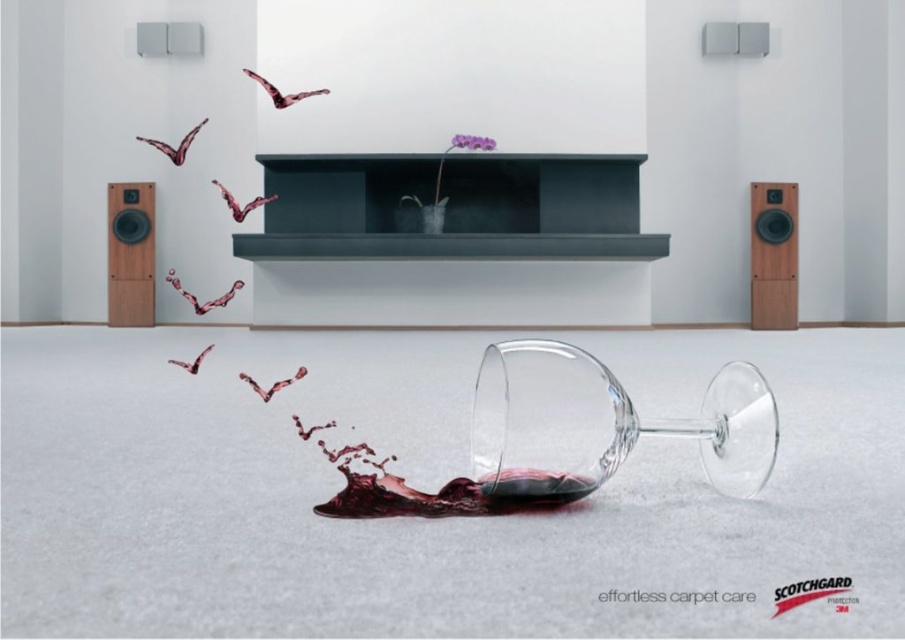
Is transparent glass at center above cherry wood speaker at right?

Actually, transparent glass at center is below cherry wood speaker at right.

Where is `transparent glass at center`? transparent glass at center is located at coordinates (603, 422).

Locate an element on the screen. transparent glass at center is located at coordinates (603, 422).

Is matte black fireplace at center further to camera compared to dark red liquid at center?

Yes, matte black fireplace at center is further from the viewer.

Is matte black fireplace at center to the left of dark red liquid at center from the viewer's perspective?

Indeed, matte black fireplace at center is positioned on the left side of dark red liquid at center.

Where is `matte black fireplace at center`? The width and height of the screenshot is (905, 640). matte black fireplace at center is located at coordinates pos(450,241).

Which of these two, wooden/matte speaker at left or dark red liquid at center, stands shorter?

Standing shorter between the two is dark red liquid at center.

Between point (135, 188) and point (503, 493), which one is positioned behind?

The point (135, 188) is more distant.

Is point (141, 193) more distant than point (545, 492)?

Yes, point (141, 193) is behind point (545, 492).

Image resolution: width=905 pixels, height=640 pixels. Identify the location of wooden/matte speaker at left. [x=130, y=253].